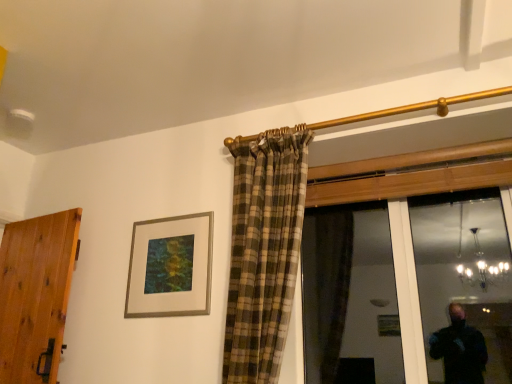
Question: From a real-world perspective, does silver metallic picture frame at upper center stand above wooden door at left?

Choices:
 (A) yes
 (B) no

Answer: (A)

Question: Considering the relative sizes of silver metallic picture frame at upper center and wooden door at left in the image provided, is silver metallic picture frame at upper center thinner than wooden door at left?

Choices:
 (A) no
 (B) yes

Answer: (B)

Question: Is silver metallic picture frame at upper center further to the viewer compared to wooden door at left?

Choices:
 (A) yes
 (B) no

Answer: (A)

Question: Is silver metallic picture frame at upper center oriented towards wooden door at left?

Choices:
 (A) no
 (B) yes

Answer: (A)

Question: Is silver metallic picture frame at upper center not close to wooden door at left?

Choices:
 (A) no
 (B) yes

Answer: (A)

Question: Are silver metallic picture frame at upper center and wooden door at left making contact?

Choices:
 (A) yes
 (B) no

Answer: (B)

Question: Does wooden door at left touch silver metallic picture frame at upper center?

Choices:
 (A) no
 (B) yes

Answer: (A)

Question: Is wooden door at left aimed at silver metallic picture frame at upper center?

Choices:
 (A) yes
 (B) no

Answer: (B)

Question: Considering the relative positions of wooden door at left and silver metallic picture frame at upper center in the image provided, is wooden door at left to the left of silver metallic picture frame at upper center from the viewer's perspective?

Choices:
 (A) yes
 (B) no

Answer: (A)

Question: Is wooden door at left wider than silver metallic picture frame at upper center?

Choices:
 (A) yes
 (B) no

Answer: (A)

Question: Is wooden door at left shorter than silver metallic picture frame at upper center?

Choices:
 (A) yes
 (B) no

Answer: (B)

Question: Is the depth of wooden door at left greater than that of silver metallic picture frame at upper center?

Choices:
 (A) no
 (B) yes

Answer: (A)

Question: Looking at their shapes, would you say wooden door at left is wider or thinner than silver metallic picture frame at upper center?

Choices:
 (A) wide
 (B) thin

Answer: (A)